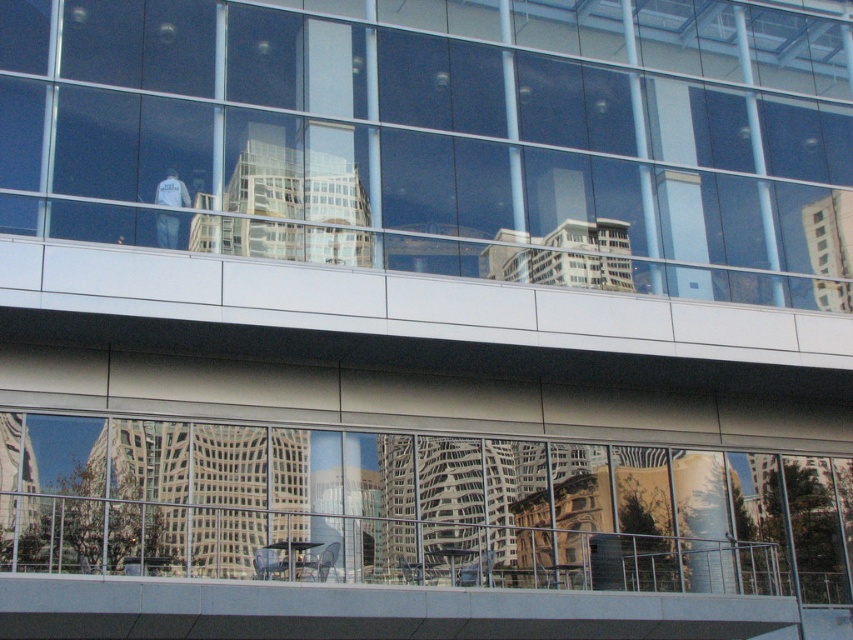
Can you confirm if transparent glass window at center is taller than transparent glass windows at lower center?

Yes.

Is transparent glass window at center above transparent glass windows at lower center?

Yes, transparent glass window at center is above transparent glass windows at lower center.

Which is behind, point (451, 56) or point (683, 508)?

The point (683, 508) is behind.

In order to click on transparent glass window at center in this screenshot , I will do `click(425, 145)`.